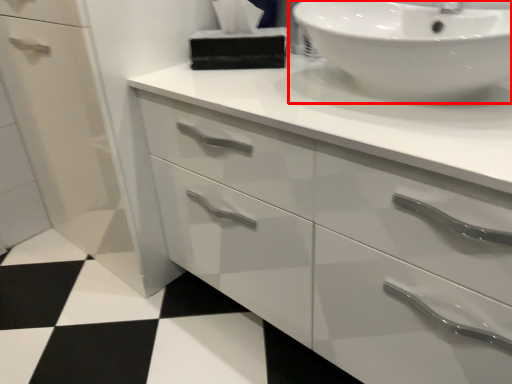
Question: Where is sink (annotated by the red box) located in relation to tissue in the image?

Choices:
 (A) right
 (B) left

Answer: (A)